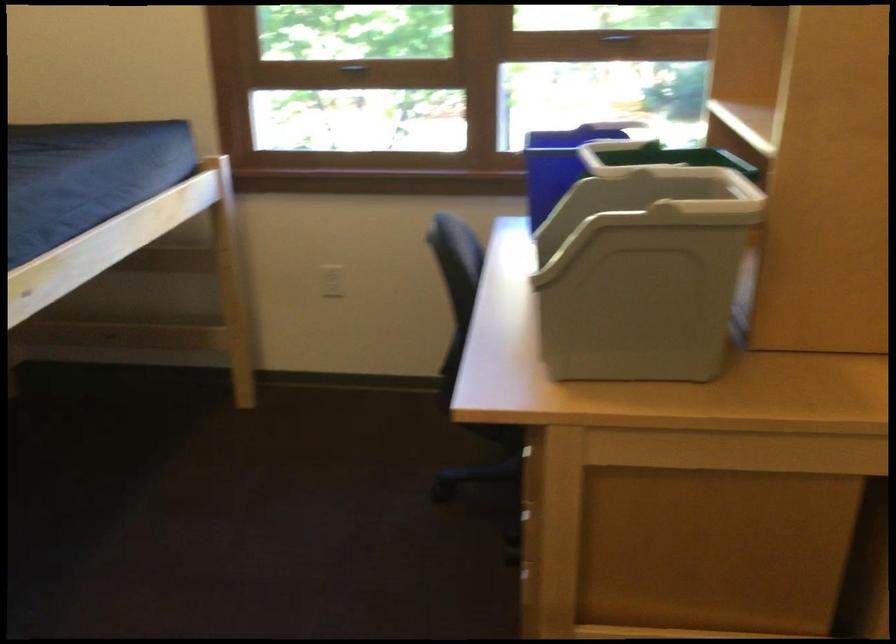
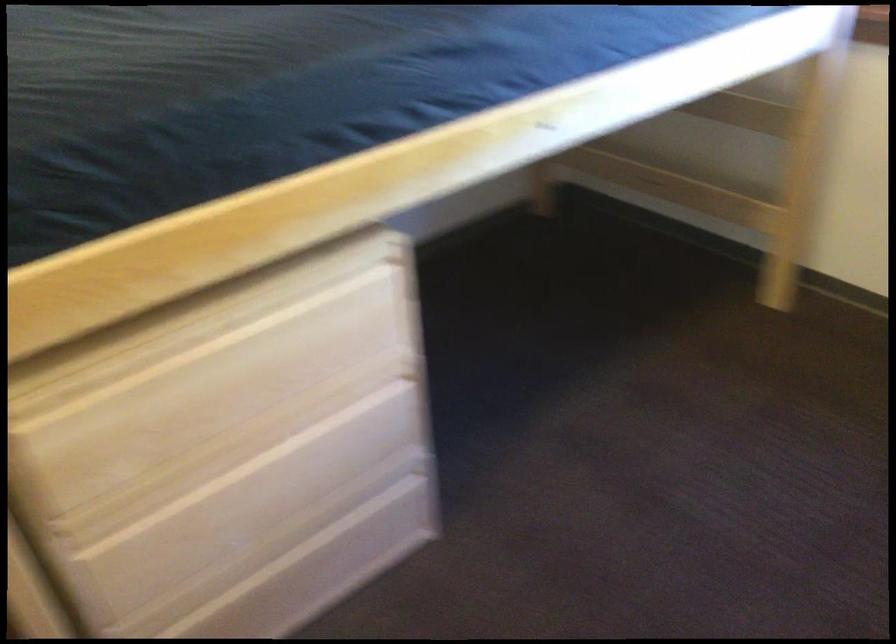
The images are taken continuously from a first-person perspective. In which direction is your viewpoint rotating?

The camera rotated toward left-down.